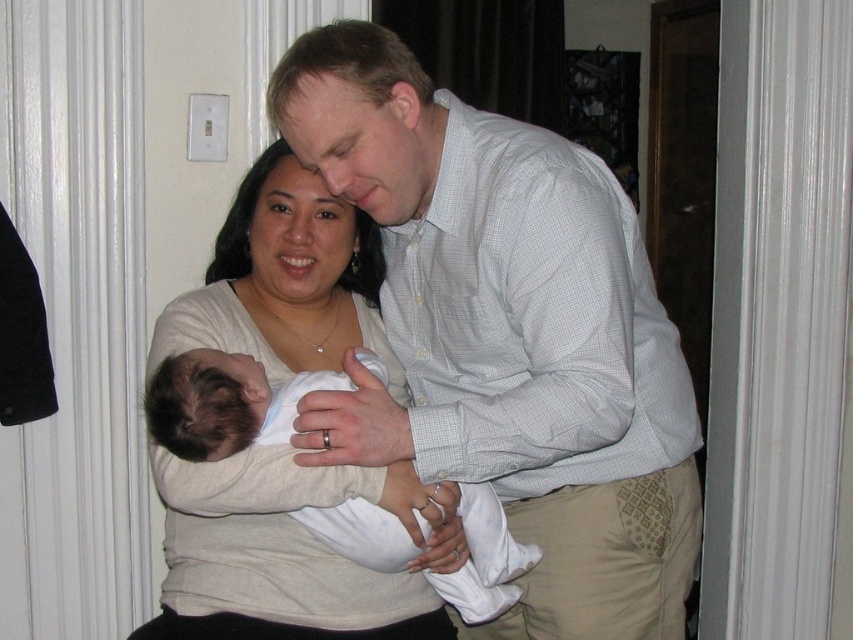
Question: Is light beige sweater at center to the left of white soft fabric newborn at center from the viewer's perspective?

Choices:
 (A) no
 (B) yes

Answer: (B)

Question: Is light blue checkered shirt at center closer to camera compared to white soft fabric newborn at center?

Choices:
 (A) yes
 (B) no

Answer: (A)

Question: Estimate the real-world distances between objects in this image. Which object is farther from the light blue checkered shirt at center?

Choices:
 (A) light beige sweater at center
 (B) white soft fabric newborn at center

Answer: (A)

Question: Which of the following is the farthest from the observer?

Choices:
 (A) light beige sweater at center
 (B) light blue checkered shirt at center

Answer: (A)

Question: Which object is closer to the camera taking this photo?

Choices:
 (A) light blue checkered shirt at center
 (B) light beige sweater at center

Answer: (A)

Question: Does light beige sweater at center have a greater width compared to white soft fabric newborn at center?

Choices:
 (A) no
 (B) yes

Answer: (A)